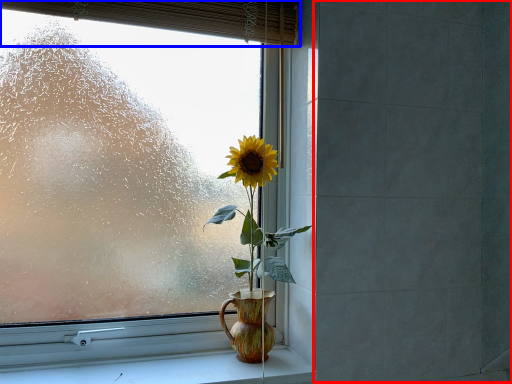
Question: Which object is further to the camera taking this photo, backdrop (highlighted by a red box) or curtain (highlighted by a blue box)?

Choices:
 (A) backdrop
 (B) curtain

Answer: (B)